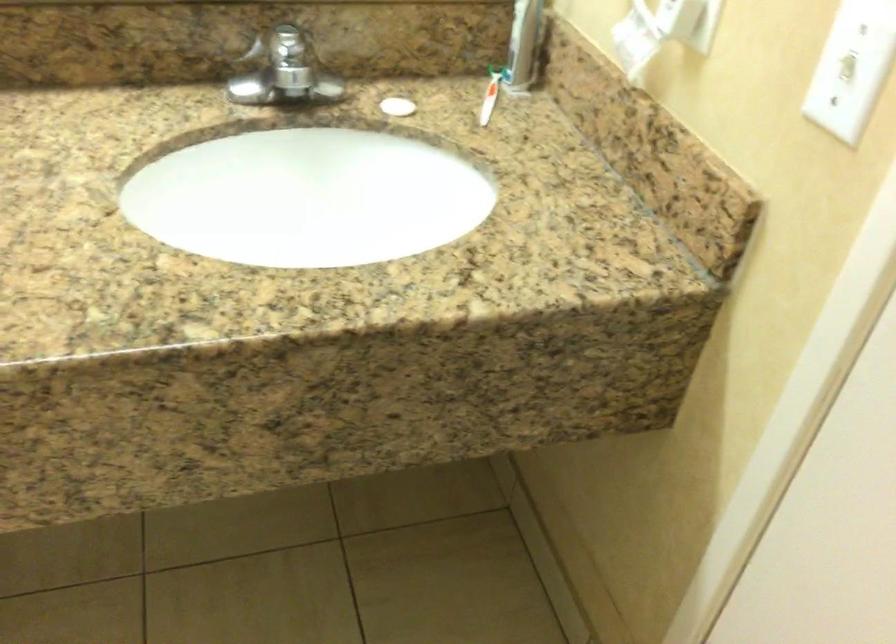
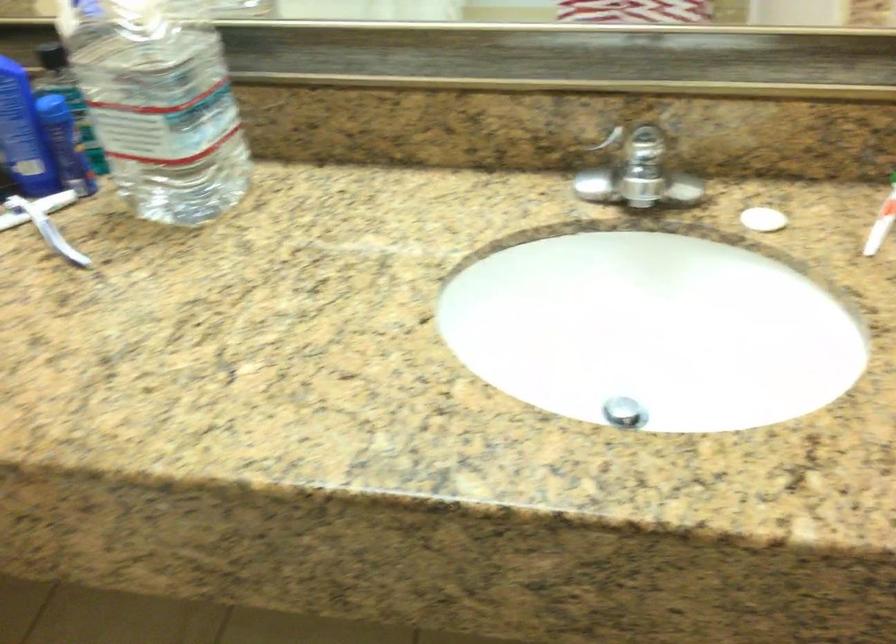
Where in the second image is the point corresponding to (489,104) from the first image?

(881, 222)